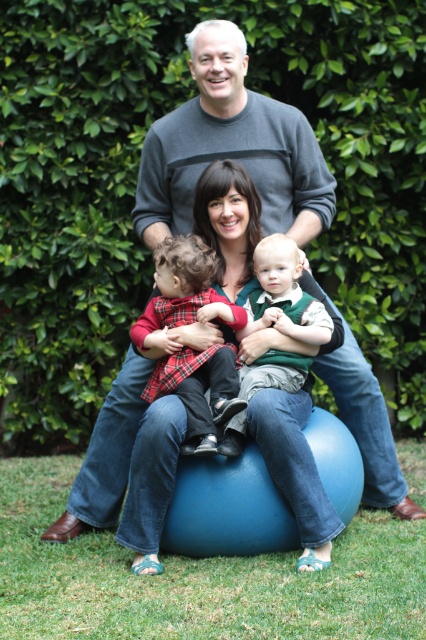
You are trying to decide which item to pack for a trip. You have a limited space in your bag. Based on the image, which item between the gray sweater at center and the green velvety vest at center takes up more space?

The gray sweater at center might be wider than green velvety vest at center, so it might take up more space in the bag.